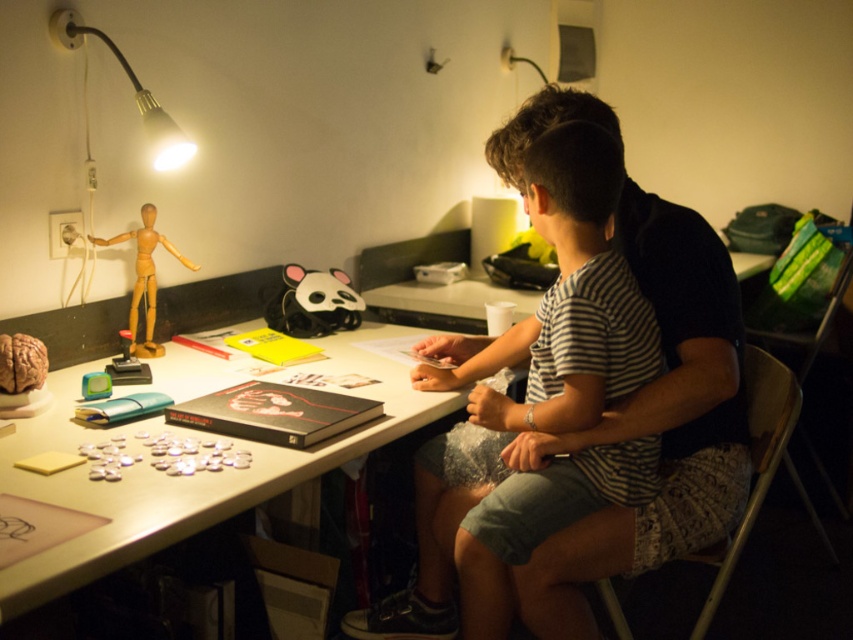
Question: Which object is the farthest from the white glossy table at center?

Choices:
 (A) striped cotton shirt at center
 (B) wooden mannequin at left
 (C) matte black lamp at upper left

Answer: (C)

Question: Based on their relative distances, which object is nearer to the wooden mannequin at left?

Choices:
 (A) matte black lamp at upper left
 (B) white glossy table at center

Answer: (A)

Question: Does striped cotton shirt at center have a smaller size compared to wooden mannequin at left?

Choices:
 (A) yes
 (B) no

Answer: (B)

Question: Among these objects, which one is farthest from the camera?

Choices:
 (A) striped cotton shirt at center
 (B) matte black lamp at upper left
 (C) white glossy table at center

Answer: (B)

Question: Can you confirm if striped cotton shirt at center is wider than wooden mannequin at left?

Choices:
 (A) no
 (B) yes

Answer: (B)

Question: Does matte black lamp at upper left appear on the left side of wooden mannequin at left?

Choices:
 (A) yes
 (B) no

Answer: (A)